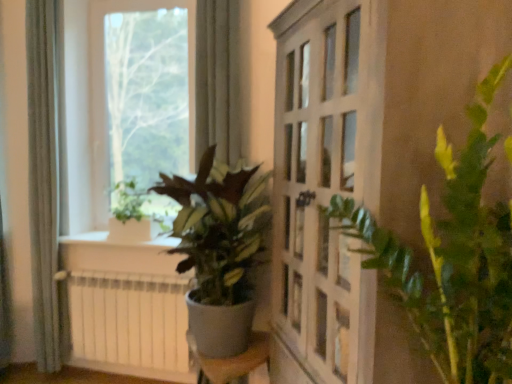
Find the location of a particular element. The width and height of the screenshot is (512, 384). vacant space situated above white matte radiator at lower left (from a real-world perspective) is located at coordinates (119, 272).